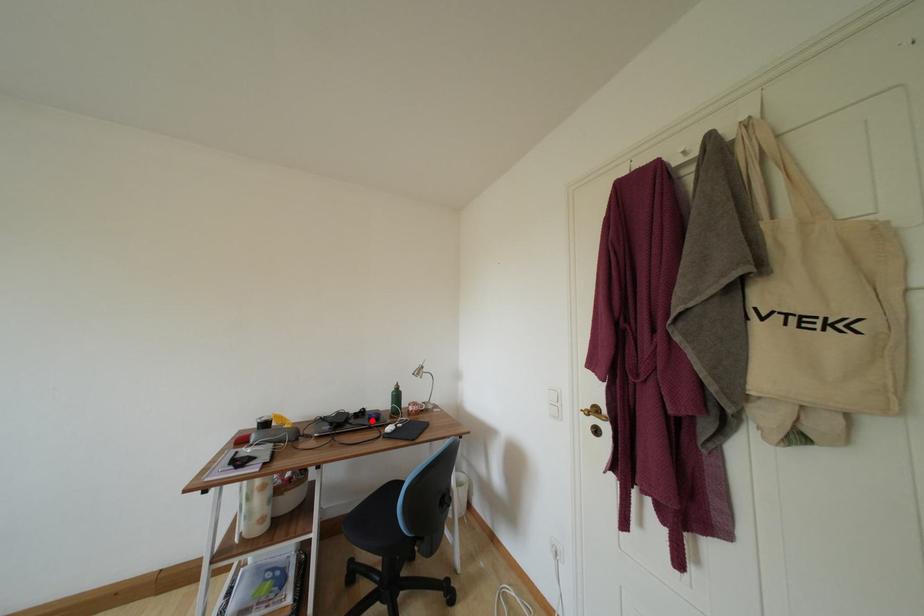
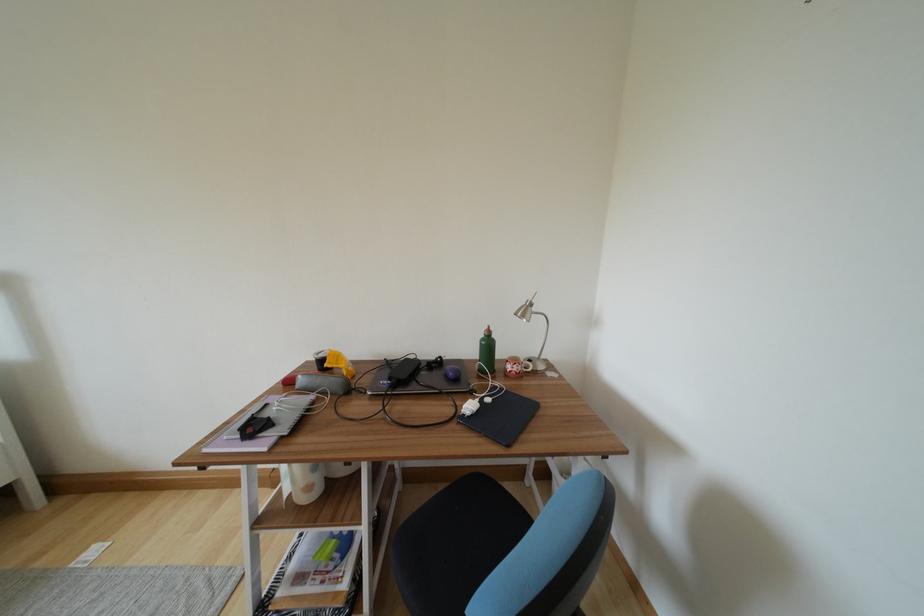
The point at the highlighted location is marked in the first image. Where is the corresponding point in the second image?

(448, 376)